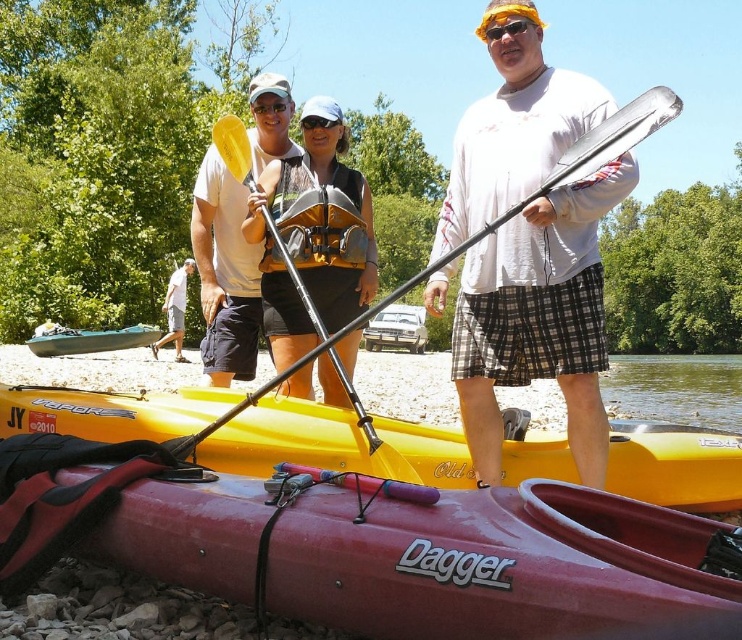
You are a photographer trying to capture a photo of the white matte shirt at upper center and the maroon rubber kayak at center. Based on their positions, which object should you focus on first if you want to include both in your shot without moving the camera?

The maroon rubber kayak at center should be focused on first because the white matte shirt at upper center is to the right of it, so adjusting focus to the kayak ensures both are within the frame.

You are a photographer trying to capture a closeup of the yellow life vest at center and the matte yellow sunglasses at center. Since you want to focus on both items clearly, which one should you adjust your camera focus to prioritize given their sizes?

The yellow life vest at center is larger in size than matte yellow sunglasses at center, so you should prioritize focusing on the yellow life vest at center to ensure both are in focus.